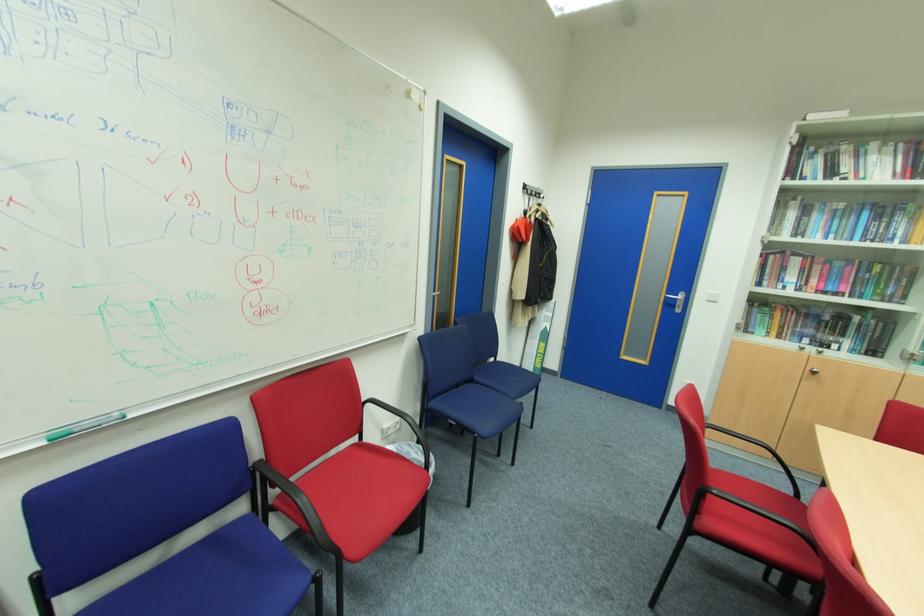
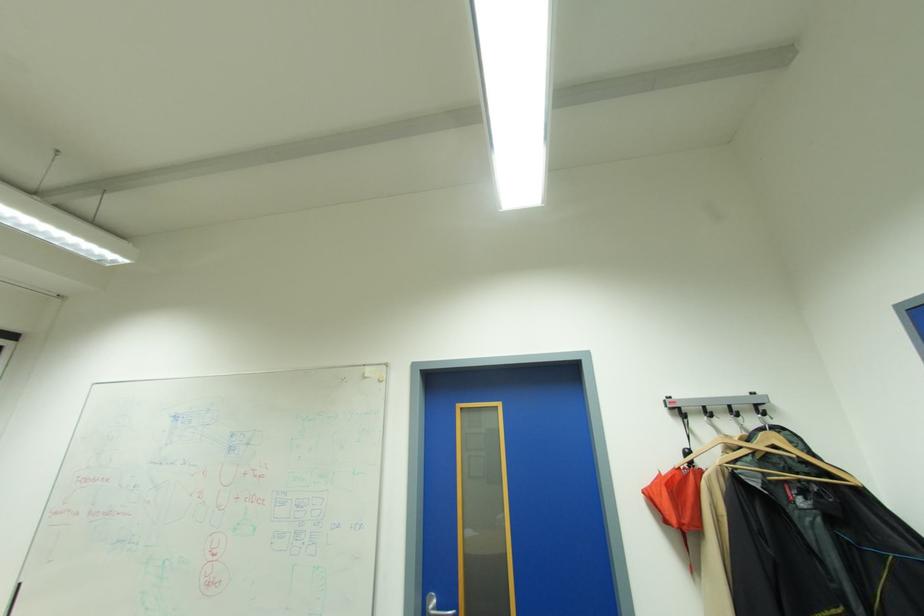
Locate, in the second image, the point that corresponds to point 523,219 in the first image.

(667, 474)